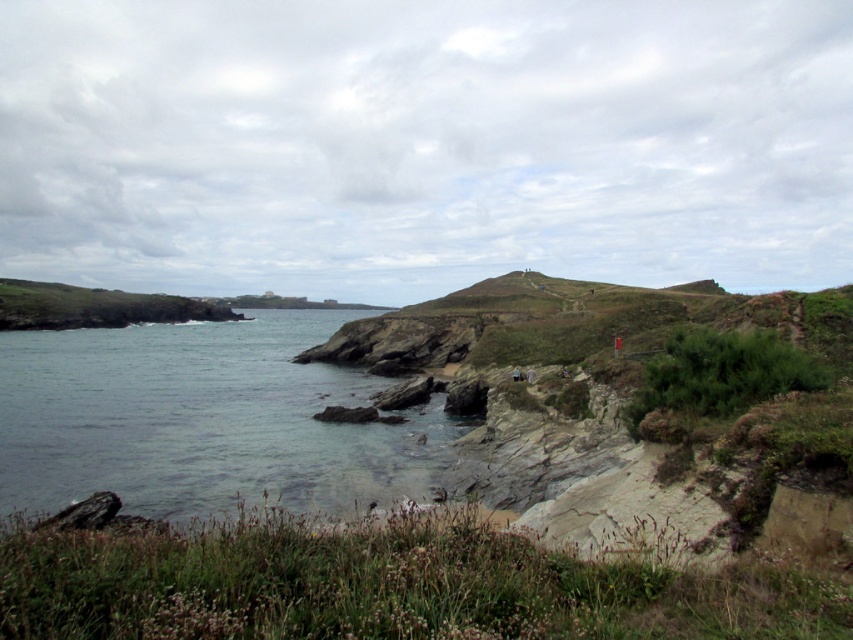
Does clear water at lower left have a lesser height compared to green grassy hillside at left?

Indeed, clear water at lower left has a lesser height compared to green grassy hillside at left.

Is clear water at lower left above green grassy hillside at left?

No.

Describe the element at coordinates (204, 420) in the screenshot. I see `clear water at lower left` at that location.

Find the location of a particular element. The height and width of the screenshot is (640, 853). clear water at lower left is located at coordinates (204, 420).